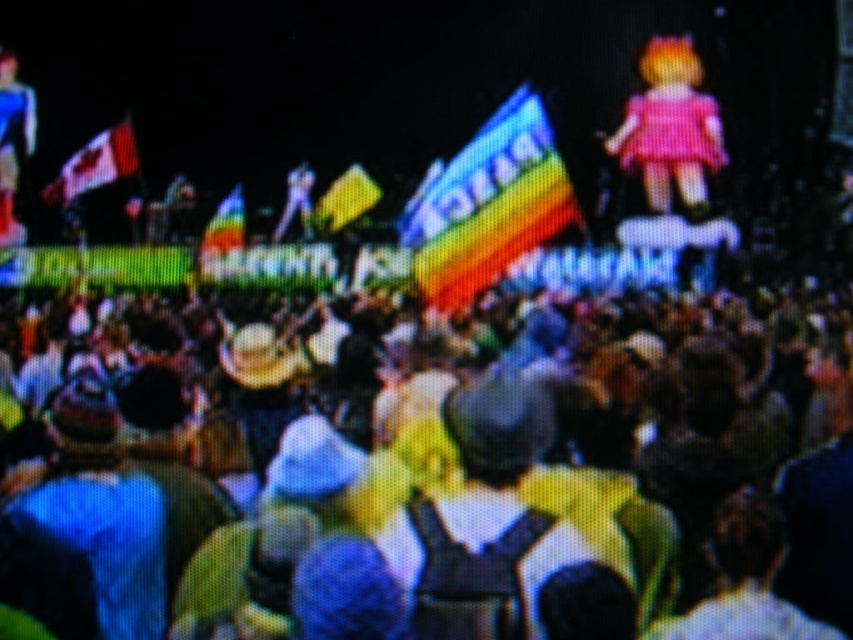
Question: Which point is farther to the camera?

Choices:
 (A) (345, 196)
 (B) (625, 152)

Answer: (A)

Question: Is multicolored fabric crowd at center wider than matte black flag at upper left?

Choices:
 (A) no
 (B) yes

Answer: (B)

Question: Is rainbow fabric flag at center above rainbow fabric flag at upper center?

Choices:
 (A) yes
 (B) no

Answer: (A)

Question: Among these points, which one is nearest to the camera?

Choices:
 (A) (131, 156)
 (B) (224, 220)

Answer: (B)

Question: Which point appears closest to the camera in this image?

Choices:
 (A) (328, 216)
 (B) (672, 52)

Answer: (B)

Question: Can you confirm if multicolored fabric crowd at center is thinner than yellow fabric flag at upper center?

Choices:
 (A) yes
 (B) no

Answer: (B)